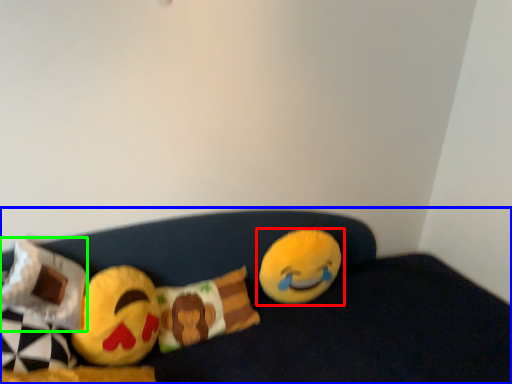
Question: Which is nearer to the toy (highlighted by a red box)? furniture (highlighted by a blue box) or pillow (highlighted by a green box).

Choices:
 (A) furniture
 (B) pillow

Answer: (A)